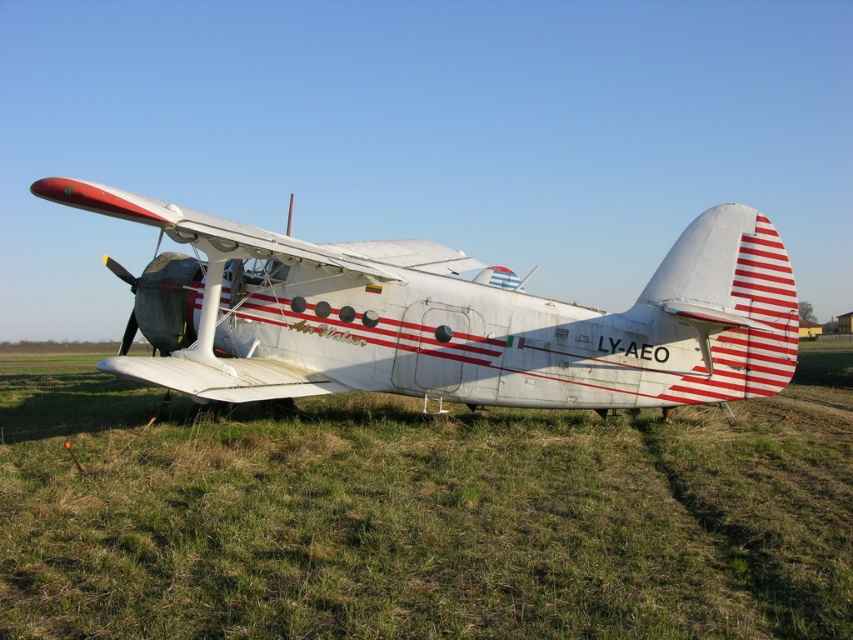
Which of these two, green grass at lower center or white matte airplane at center, stands shorter?

With less height is green grass at lower center.

Between point (619, 529) and point (218, 244), which one is positioned behind?

Positioned behind is point (218, 244).

Image resolution: width=853 pixels, height=640 pixels. Describe the element at coordinates (421, 515) in the screenshot. I see `green grass at lower center` at that location.

In order to click on green grass at lower center in this screenshot , I will do `click(421, 515)`.